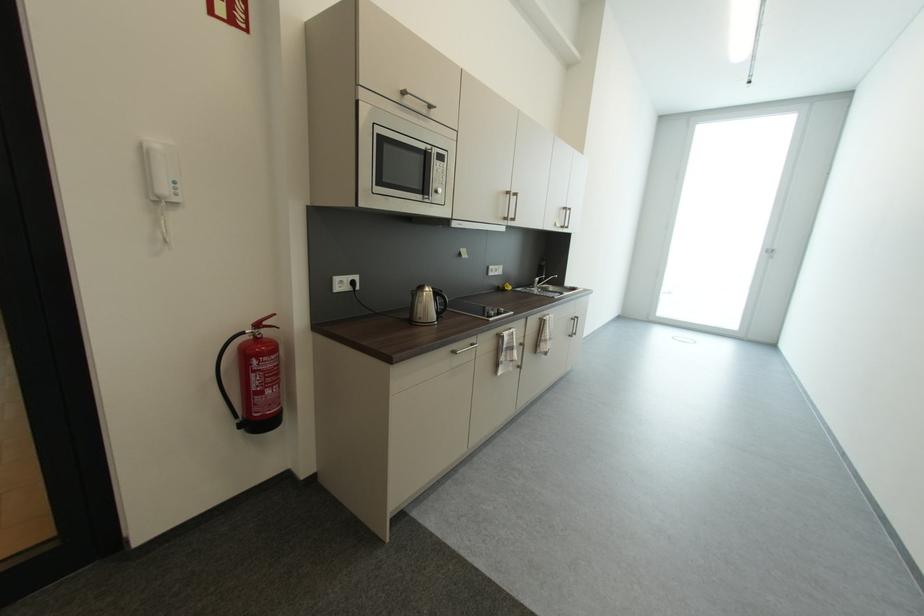
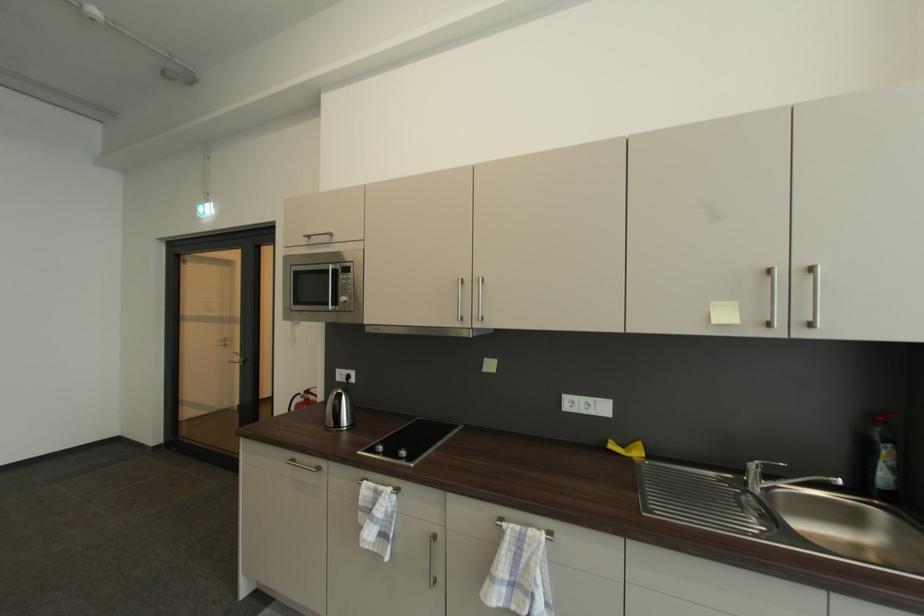
Locate, in the second image, the point that corresponds to (x=264, y=326) in the first image.

(314, 392)